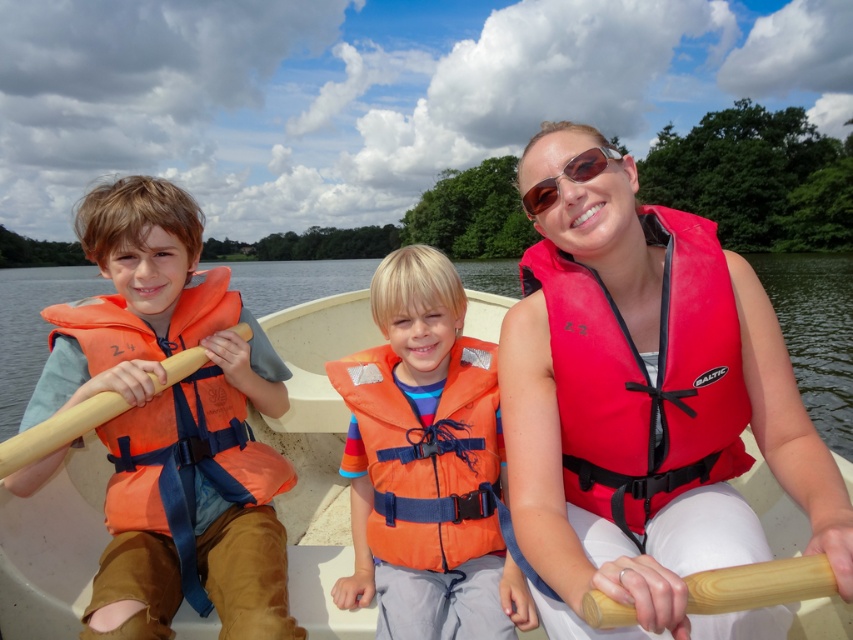
Question: Is white plastic boat at center to the right of sunglasses at center from the viewer's perspective?

Choices:
 (A) yes
 (B) no

Answer: (B)

Question: Is white plastic boat at center closer to the viewer compared to wooden paddle at center?

Choices:
 (A) yes
 (B) no

Answer: (B)

Question: Among these objects, which one is farthest from the camera?

Choices:
 (A) wooden paddle at center
 (B) white plastic boat at center
 (C) orange life vest at left

Answer: (B)

Question: Which point is closer to the camera taking this photo?

Choices:
 (A) [3, 460]
 (B) [589, 168]
 (C) [120, 509]

Answer: (A)

Question: Does red nylon life jacket at right have a smaller size compared to wooden paddle at left?

Choices:
 (A) no
 (B) yes

Answer: (A)

Question: Which object is the closest to the orange life vest at left?

Choices:
 (A) wooden paddle at center
 (B) red nylon life vest at center
 (C) white plastic boat at center

Answer: (B)